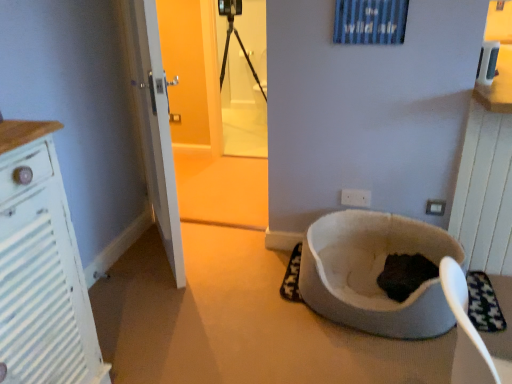
Question: From a real-world perspective, is white plastic electric outlet at lower right, placed as the 2th electric outlet when sorted from left to right, over white plastic electric outlet at center, positioned as the 1th electric outlet in back-to-front order?

Choices:
 (A) yes
 (B) no

Answer: (B)

Question: Is white plastic electric outlet at lower right, marked as the first electric outlet in a front-to-back arrangement, facing towards white plastic electric outlet at center, marked as the 1th electric outlet in a left-to-right arrangement?

Choices:
 (A) yes
 (B) no

Answer: (B)

Question: Is white plastic electric outlet at center, which appears as the second electric outlet when viewed from the right, located within white plastic electric outlet at lower right, placed as the 2th electric outlet when sorted from back to front?

Choices:
 (A) yes
 (B) no

Answer: (B)

Question: Can you confirm if white plastic electric outlet at lower right, marked as the first electric outlet in a front-to-back arrangement, is smaller than white plastic electric outlet at center, marked as the 1th electric outlet in a left-to-right arrangement?

Choices:
 (A) yes
 (B) no

Answer: (A)

Question: Does white plastic electric outlet at lower right, positioned as the 1th electric outlet in right-to-left order, have a lesser height compared to white plastic electric outlet at center, positioned as the 1th electric outlet in back-to-front order?

Choices:
 (A) no
 (B) yes

Answer: (A)

Question: Visually, is white textured cabinet at left positioned to the left or to the right of white plastic electric outlet at center, which appears as the second electric outlet when viewed from the right?

Choices:
 (A) right
 (B) left

Answer: (B)

Question: Is white textured cabinet at left taller or shorter than white plastic electric outlet at center, positioned as the 1th electric outlet in back-to-front order?

Choices:
 (A) short
 (B) tall

Answer: (B)

Question: From a real-world perspective, is white textured cabinet at left positioned above or below white plastic electric outlet at center, positioned as the 1th electric outlet in back-to-front order?

Choices:
 (A) above
 (B) below

Answer: (A)

Question: Looking at their shapes, would you say white textured cabinet at left is wider or thinner than white plastic electric outlet at center, which appears as the second electric outlet when viewed from the right?

Choices:
 (A) wide
 (B) thin

Answer: (A)

Question: From the image's perspective, is white textured cabinet at left above or below white fabric cat bed at lower right?

Choices:
 (A) below
 (B) above

Answer: (B)

Question: Is white textured cabinet at left taller or shorter than white fabric cat bed at lower right?

Choices:
 (A) short
 (B) tall

Answer: (B)

Question: Is white textured cabinet at left to the left or to the right of white fabric cat bed at lower right in the image?

Choices:
 (A) right
 (B) left

Answer: (B)

Question: Considering their positions, is white textured cabinet at left located in front of or behind white fabric cat bed at lower right?

Choices:
 (A) behind
 (B) front

Answer: (B)

Question: From the image's perspective, relative to white textured cabinet at left, is transparent plastic screen door at upper center above or below?

Choices:
 (A) below
 (B) above

Answer: (B)

Question: Is point (245, 56) positioned closer to the camera than point (6, 221)?

Choices:
 (A) closer
 (B) farther

Answer: (B)